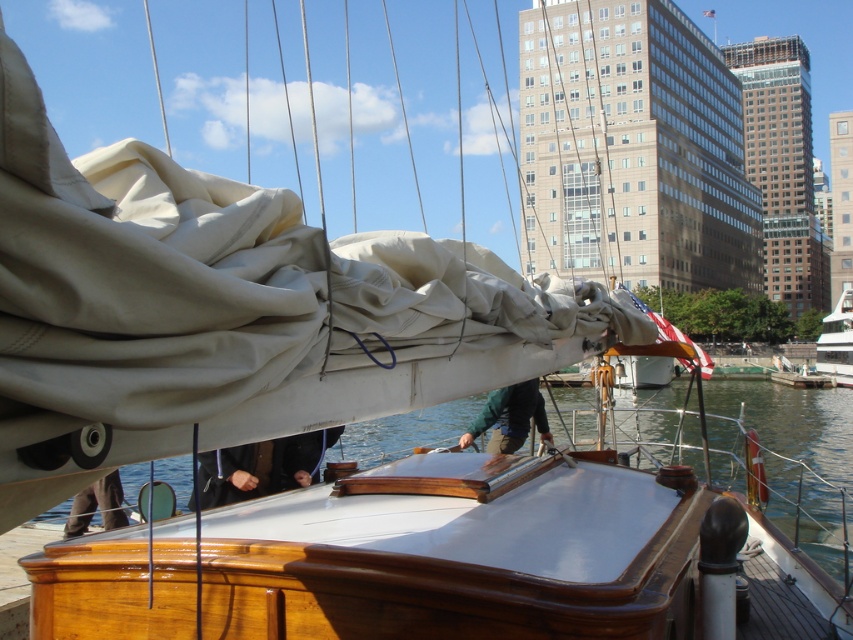
Is the position of green fabric jacket at center more distant than that of white glossy yacht at right?

No.

Can you confirm if green fabric jacket at center is wider than white glossy yacht at right?

Incorrect, green fabric jacket at center's width does not surpass white glossy yacht at right's.

The image size is (853, 640). Find the location of `green fabric jacket at center`. green fabric jacket at center is located at coordinates (509, 417).

This screenshot has height=640, width=853. In order to click on green fabric jacket at center in this screenshot , I will do `click(509, 417)`.

Does dark blue fabric at center appear under white glossy yacht at right?

Incorrect, dark blue fabric at center is not positioned below white glossy yacht at right.

Is point (323, 442) positioned before point (842, 305)?

That is True.

Locate an element on the screen. This screenshot has width=853, height=640. dark blue fabric at center is located at coordinates coord(260,467).

Find the location of a particular element. This screenshot has width=853, height=640. dark blue fabric at center is located at coordinates (260, 467).

Does wooden boat at center have a larger size compared to dark blue fabric at center?

Indeed, wooden boat at center has a larger size compared to dark blue fabric at center.

Who is lower down, wooden boat at center or dark blue fabric at center?

wooden boat at center is lower down.

Locate an element on the screen. wooden boat at center is located at coordinates (798, 456).

Where is `wooden boat at center`? wooden boat at center is located at coordinates (798, 456).